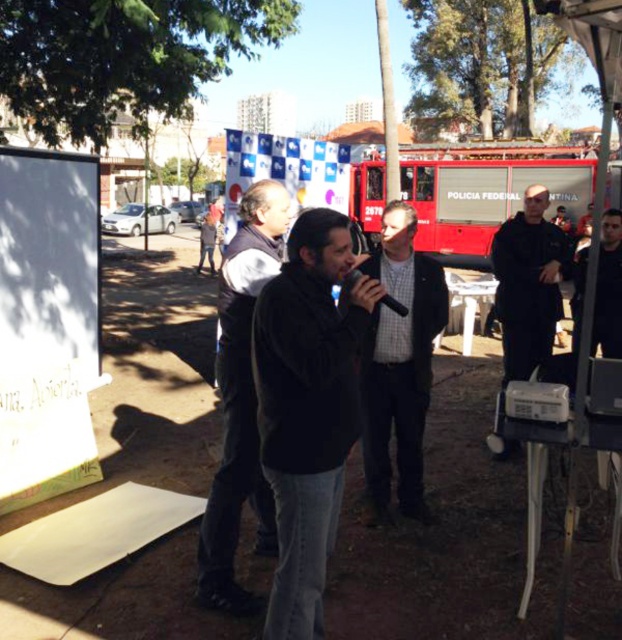
The height and width of the screenshot is (640, 622). What do you see at coordinates (307, 406) in the screenshot? I see `dark gray sweater at center` at bounding box center [307, 406].

Is dark gray sweater at center in front of dark gray jacket at center?

Yes.

Is point (330, 228) farther from viewer compared to point (437, 317)?

No.

The height and width of the screenshot is (640, 622). I want to click on dark gray sweater at center, so click(307, 406).

Does black softshell jacket at center have a greater height compared to dark gray jacket at center?

Correct, black softshell jacket at center is much taller as dark gray jacket at center.

Does black softshell jacket at center have a lesser width compared to dark gray jacket at center?

Yes.

Who is more forward, (233, 404) or (364, 456)?

Positioned in front is point (233, 404).

Locate an element on the screen. Image resolution: width=622 pixels, height=640 pixels. black softshell jacket at center is located at coordinates (239, 401).

Is point (618, 205) positioned after point (504, 456)?

Yes, point (618, 205) is farther from viewer.

Which is below, red matte truck at center or dark blue uniform at center?

Positioned lower is dark blue uniform at center.

Where is `red matte truck at center`? This screenshot has height=640, width=622. red matte truck at center is located at coordinates (486, 193).

Identify the location of red matte truck at center. This screenshot has height=640, width=622. (486, 193).